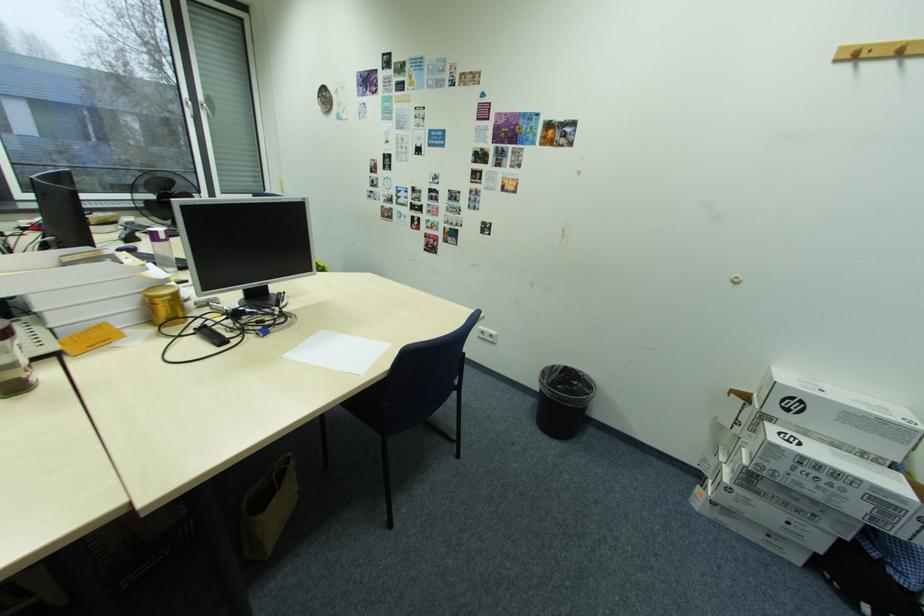
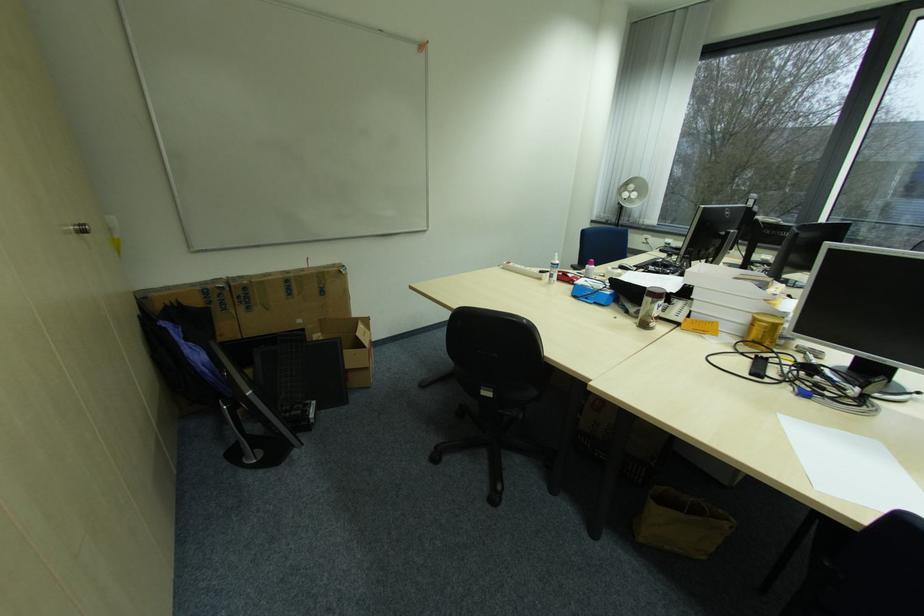
Question: I am providing you with two images of the same scene from different viewpoints. After the viewpoint changes to image2, which objects are now occluded?

Choices:
 (A) brown plastic container
 (B) white paper tray
 (C) white spray bottle
 (D) none of these

Answer: (D)